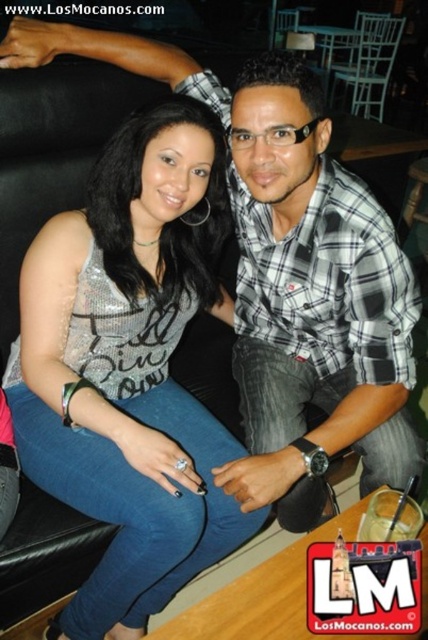
Looking at this image, which is below, satin silver tank top at center or plaid cotton shirt at center?

satin silver tank top at center

Who is more distant from viewer, (x=65, y=435) or (x=410, y=426)?

The point (x=410, y=426) is more distant.

Identify the location of satin silver tank top at center. (130, 368).